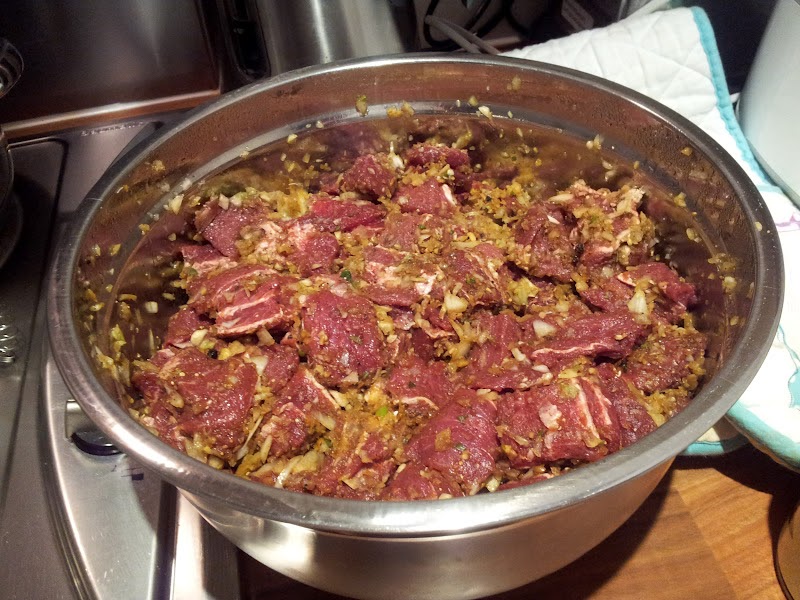
Locate an element on the screen. The width and height of the screenshot is (800, 600). side of silver metal pot is located at coordinates (522, 544).